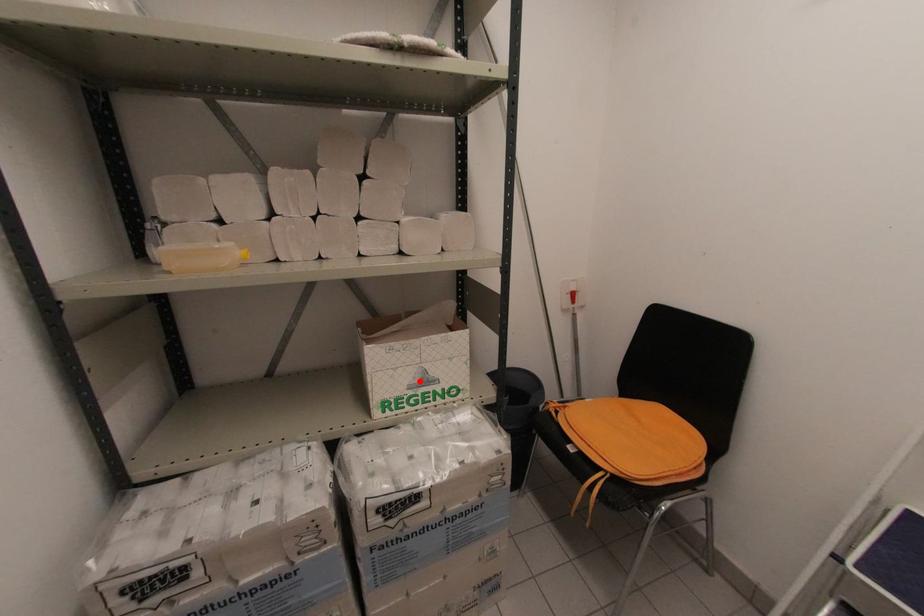
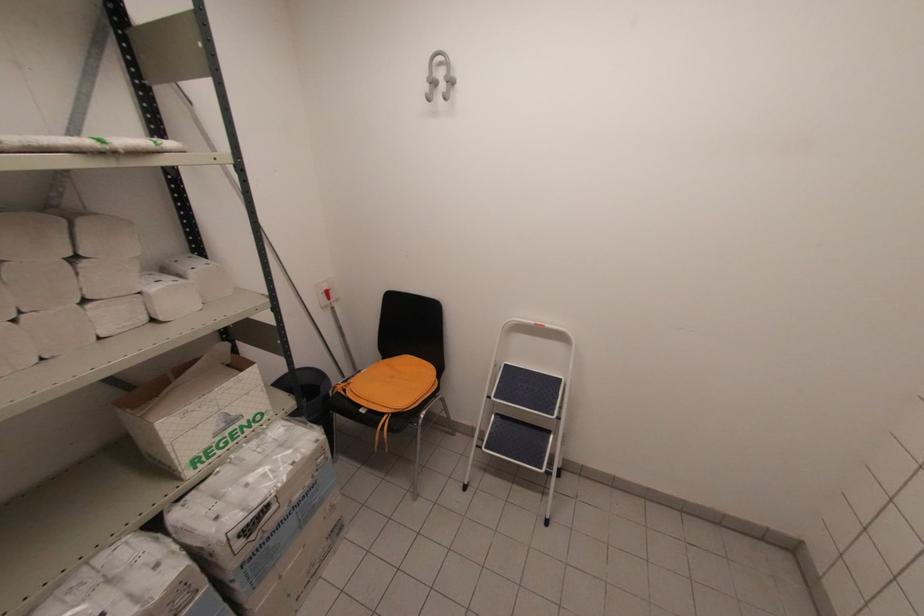
Locate, in the second image, the point that corresponds to the highlighted location in the first image.

(224, 426)